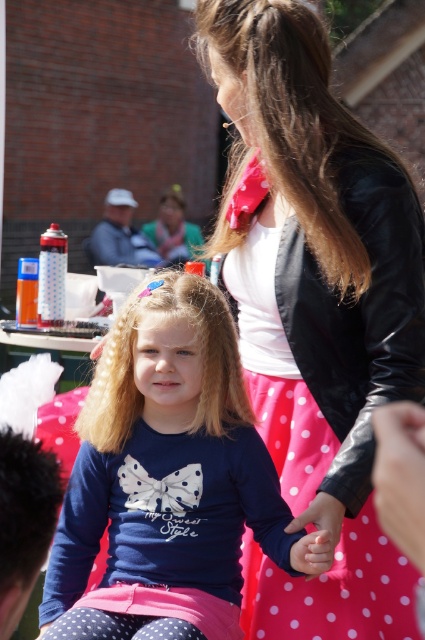
You are at a community event and see two points marked on the ground. The first point is at coordinate point (172, 284) and the second point is at coordinate point (317, 561). Which point is closer to the young girl sitting on the red chair with white polka dots?

Point (172, 284) is behind point (317, 561), so the second point at (317, 561) is closer to the young girl sitting on the red chair with white polka dots.

Based on the photo, what is the exact 2D coordinate of the blondehair at center?

The blondehair at center is located at the coordinate point of (133, 364).

You are a photographer at this event and want to ensure the blondehair at center and pink fabric hand at center are both visible in your photo. Based on their positions, which one should you adjust your camera focus to prioritize to capture both?

Since the blondehair at center is to the left of the pink fabric hand at center, you should adjust your camera focus to prioritize the pink fabric hand at center so that both are in frame.